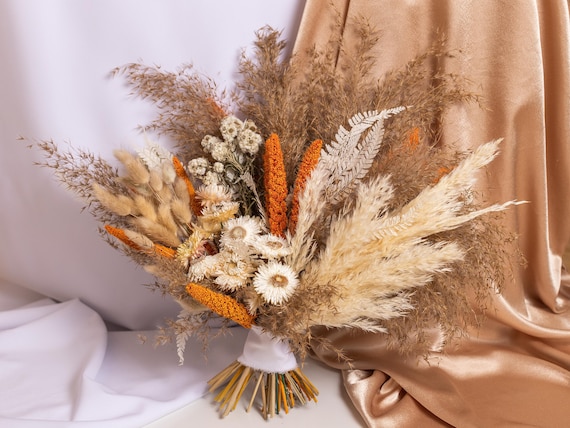
Find the location of a particular element. The width and height of the screenshot is (570, 428). beige wheat like plant is located at coordinates (399, 258).